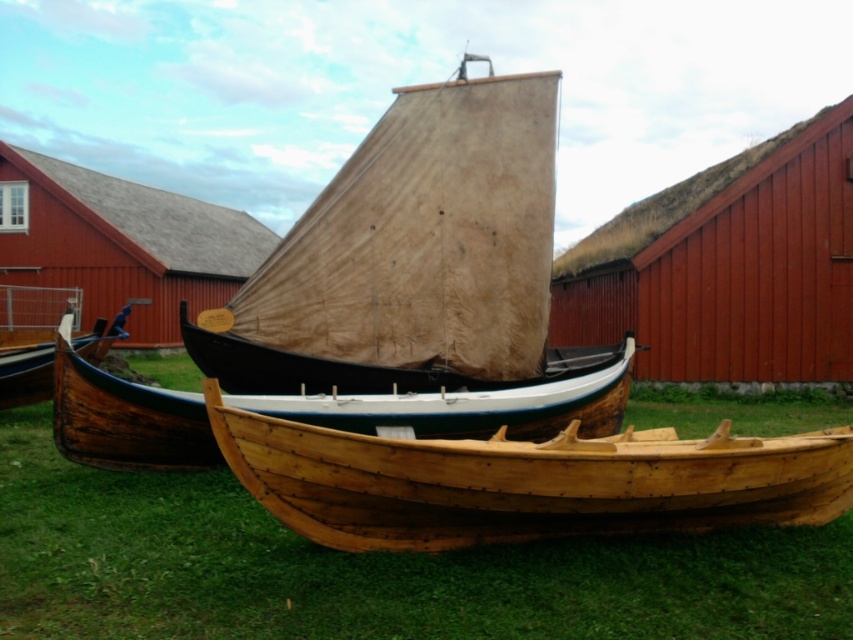
You are standing at the entrance of the museum and see the point marked at coordinates [369,568]. What object is located at that point?

The point at coordinates [369,568] corresponds to the natural wood boat at center.

You are planning to transport both the beige canvas sailboat at center and the natural wood canoe at center across a narrow bridge. The bridge has a maximum width limit of 2 meters. Based on their sizes, can both vessels fit side by side on the bridge without exceeding the width limit?

The beige canvas sailboat at center might be wider than the natural wood canoe at center. Since the sailboat could be wider, it is uncertain if both would fit within the 2 meter limit without exceeding it. Check their exact widths before deciding.